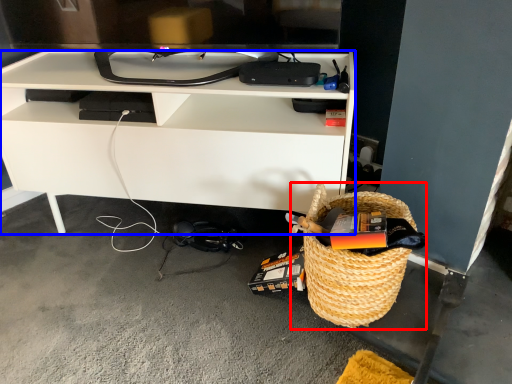
Question: Among these objects, which one is farthest to the camera, picnic basket (highlighted by a red box) or desk (highlighted by a blue box)?

Choices:
 (A) picnic basket
 (B) desk

Answer: (B)